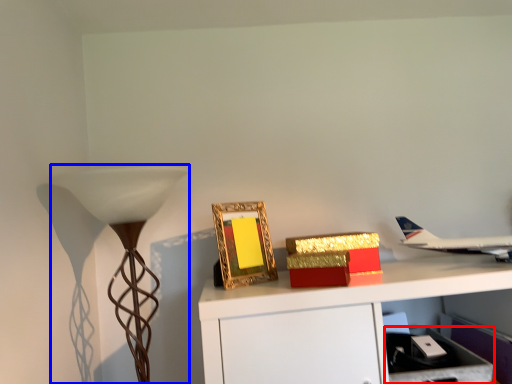
Question: Which object appears farthest to the camera in this image, drawer (highlighted by a red box) or lamp (highlighted by a blue box)?

Choices:
 (A) drawer
 (B) lamp

Answer: (A)